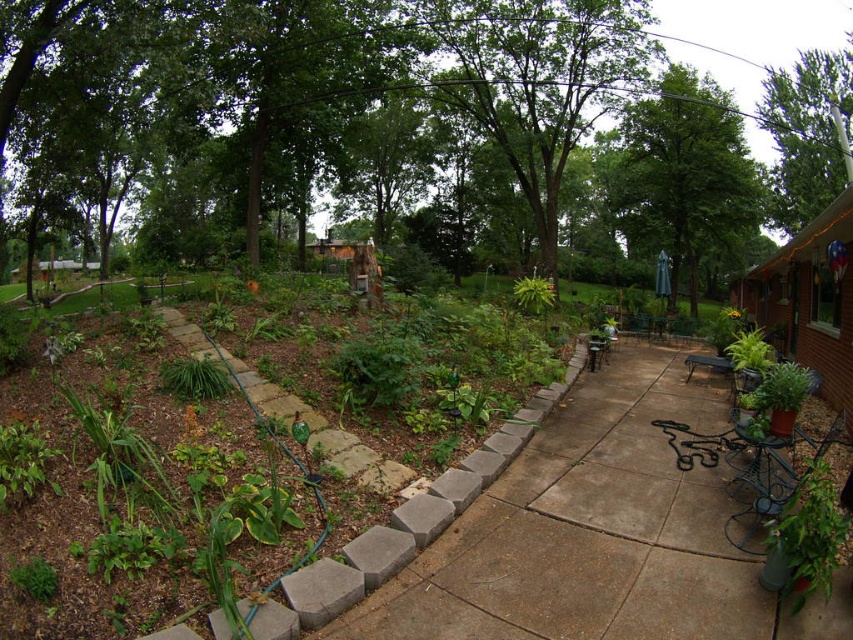
Can you confirm if green leafy plant at lower right is wider than green leafy plant at lower left?

Indeed, green leafy plant at lower right has a greater width compared to green leafy plant at lower left.

Does green leafy plant at lower right have a larger size compared to green leafy plant at lower left?

Correct, green leafy plant at lower right is larger in size than green leafy plant at lower left.

This screenshot has width=853, height=640. In order to click on green leafy plant at lower right in this screenshot , I will do `click(805, 538)`.

I want to click on green leafy plant at lower right, so click(805, 538).

Is brown concrete patio at center taller than green leafy plant at lower right?

No, brown concrete patio at center is not taller than green leafy plant at lower right.

Who is more forward, [612,403] or [805,586]?

Positioned in front is point [805,586].

Where is `brown concrete patio at center`? brown concrete patio at center is located at coordinates click(596, 534).

Can you confirm if brown concrete patio at center is positioned above green leafy plant at lower left?

Incorrect, brown concrete patio at center is not positioned above green leafy plant at lower left.

Between brown concrete patio at center and green leafy plant at lower left, which one has more height?

Standing taller between the two is green leafy plant at lower left.

Between point (757, 618) and point (173, 368), which one is positioned in front?

Point (757, 618) is in front.

Identify the location of brown concrete patio at center. Image resolution: width=853 pixels, height=640 pixels. (596, 534).